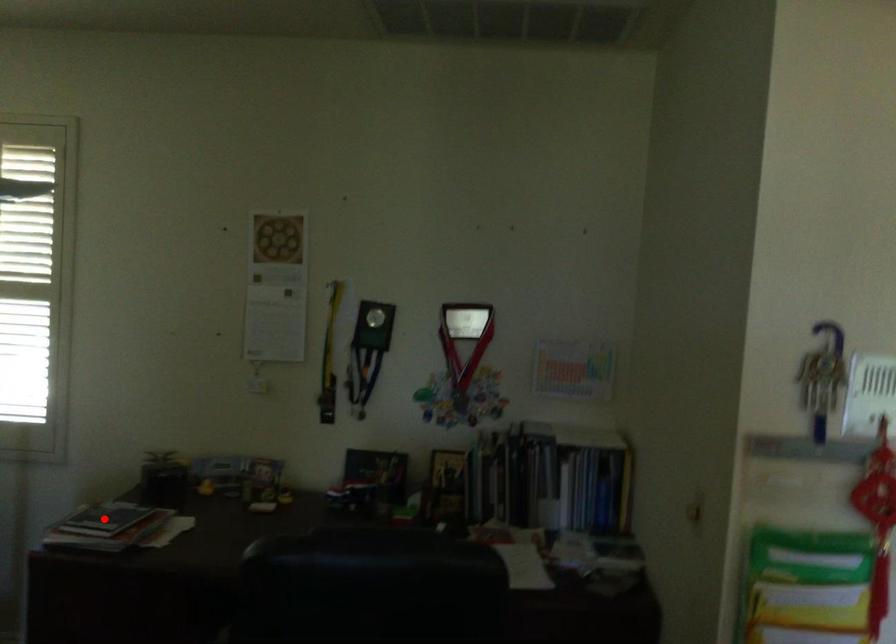
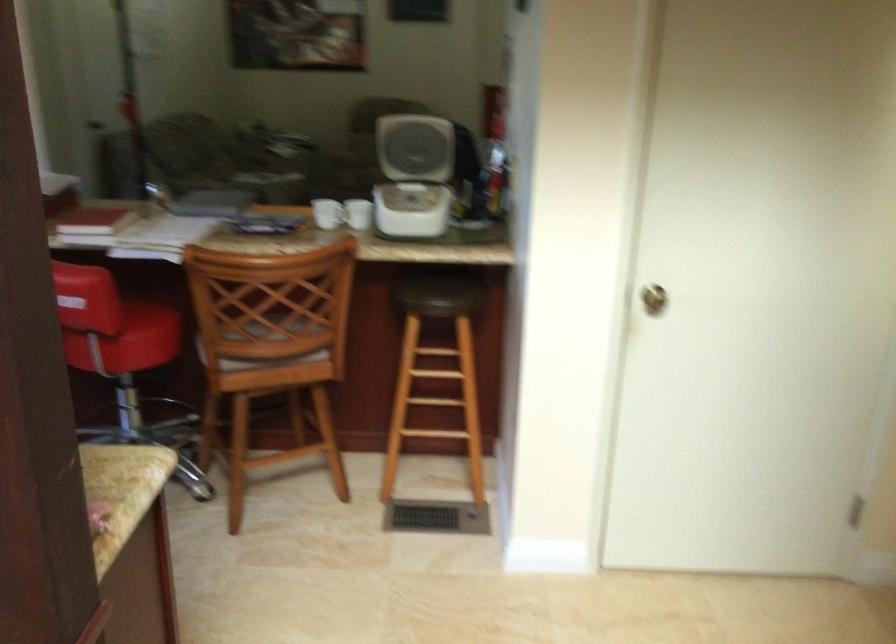
Question: I am providing you with two images of the same scene from different viewpoints. A red point is marked on the first image. Can you still see the location of the red point in image 2?

Choices:
 (A) Yes
 (B) No

Answer: (B)